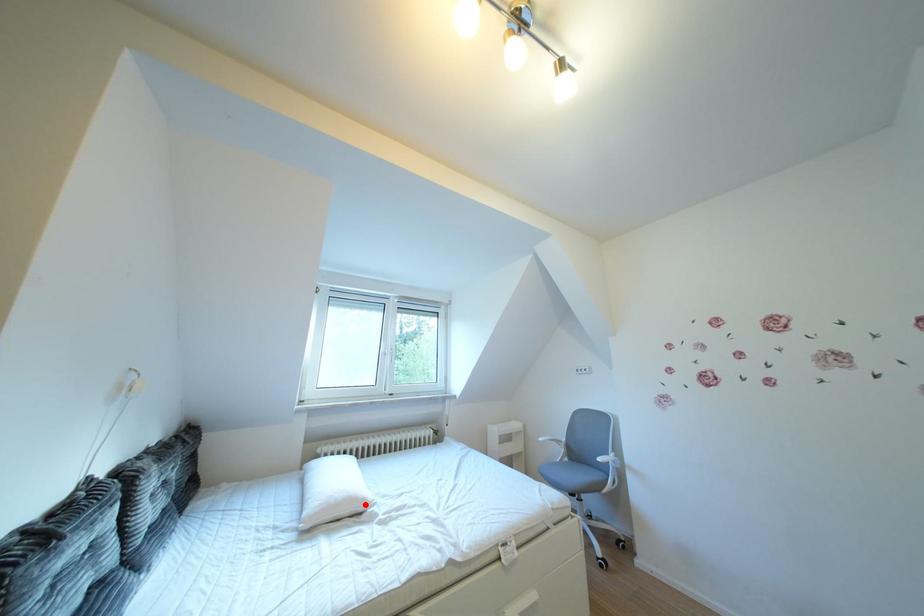
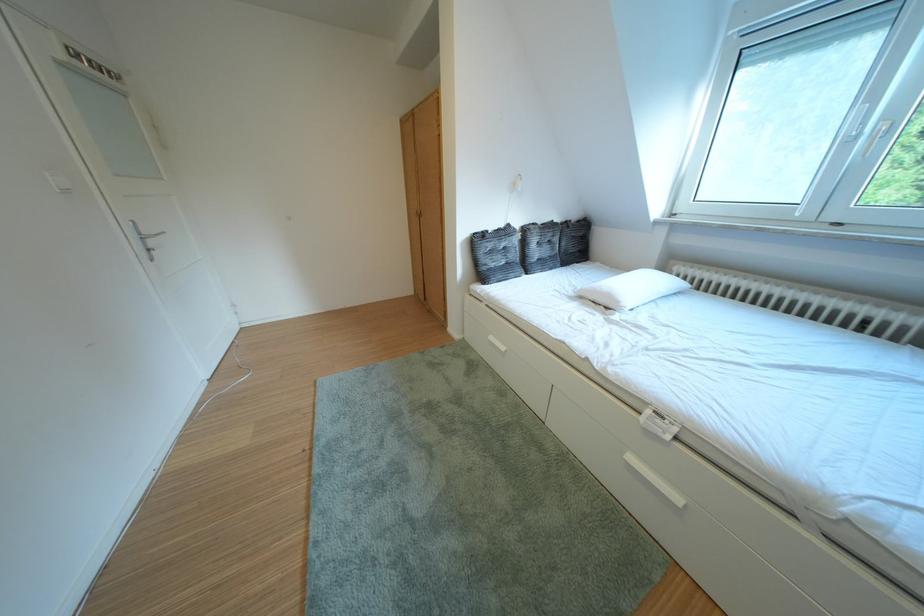
The point at the highlighted location is marked in the first image. Where is the corresponding point in the second image?

(623, 301)